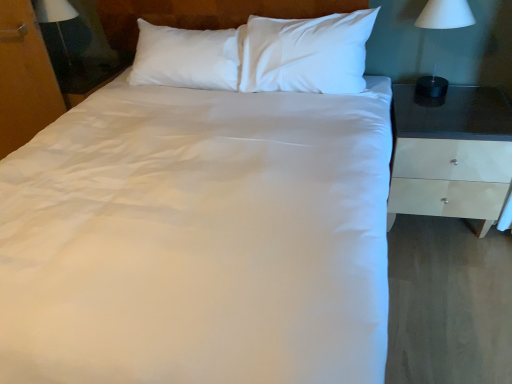
Question: In terms of width, does white matte lamp at right, the 2th bedside lamp from the back, look wider or thinner when compared to wooden dresser at left?

Choices:
 (A) wide
 (B) thin

Answer: (A)

Question: From the image's perspective, is white matte lamp at right, which appears as the second bedside lamp when viewed from the left, located above or below wooden dresser at left?

Choices:
 (A) below
 (B) above

Answer: (B)

Question: Which object is the farthest from the white glossy nightstand at right?

Choices:
 (A) wooden dresser at left
 (B) white matte lamp at right, the first bedside lamp from the right
 (C) matte black lampshade at left, the second bedside lamp from the front

Answer: (C)

Question: Estimate the real-world distances between objects in this image. Which object is closer to the wooden dresser at left?

Choices:
 (A) matte black lampshade at left, which ranks as the 1th bedside lamp in left-to-right order
 (B) white glossy nightstand at right
 (C) white matte lamp at right, the first bedside lamp from the right

Answer: (A)